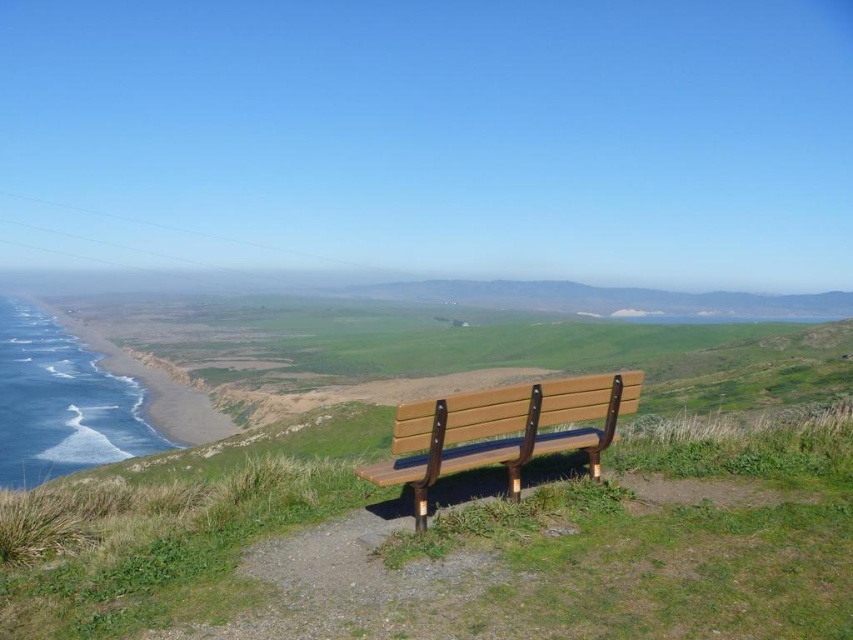
Question: Which point is farther to the camera?

Choices:
 (A) wooden bench at center
 (B) blue smooth water at lower left
 (C) green grassy at center

Answer: (B)

Question: Among these points, which one is farthest from the camera?

Choices:
 (A) (4, 420)
 (B) (495, 400)

Answer: (A)

Question: Is green grassy at center smaller than blue smooth water at lower left?

Choices:
 (A) yes
 (B) no

Answer: (A)

Question: Does green grassy at center appear on the left side of wooden bench at center?

Choices:
 (A) no
 (B) yes

Answer: (B)

Question: Among these objects, which one is farthest from the camera?

Choices:
 (A) blue smooth water at lower left
 (B) wooden bench at center
 (C) green grassy at center

Answer: (A)

Question: Is green grassy at center wider than blue smooth water at lower left?

Choices:
 (A) no
 (B) yes

Answer: (A)